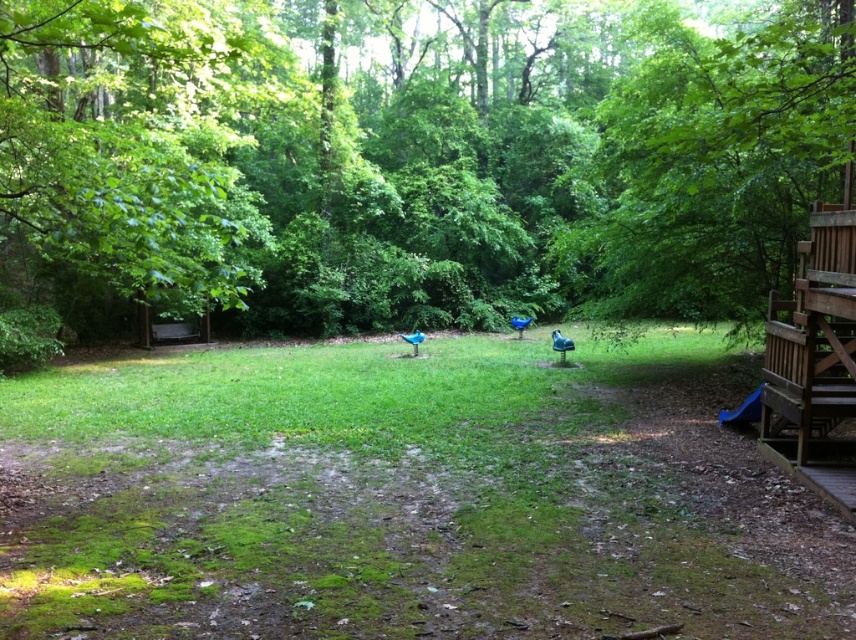
Between point (551, 339) and point (414, 337), which one is positioned in front?

Point (414, 337)

Is point (563, 349) closer to viewer compared to point (405, 339)?

Yes, point (563, 349) is in front of point (405, 339).

Who is more distant from viewer, [566,342] or [417,342]?

The point [417,342] is more distant.

Find the location of a particular element. This screenshot has height=640, width=856. green matte bird at center is located at coordinates (562, 344).

Does green grass at center have a lesser height compared to blue glossy statue at center?

No, green grass at center is not shorter than blue glossy statue at center.

Does point (248, 452) lie behind point (522, 326)?

No.

What do you see at coordinates (409, 497) in the screenshot? Image resolution: width=856 pixels, height=640 pixels. I see `green grass at center` at bounding box center [409, 497].

This screenshot has width=856, height=640. What are the coordinates of `green grass at center` in the screenshot? It's located at (409, 497).

Can you confirm if blue glossy bird at center is positioned below blue glossy statue at center?

Indeed, blue glossy bird at center is positioned under blue glossy statue at center.

Does blue glossy bird at center have a greater height compared to blue glossy statue at center?

Incorrect, blue glossy bird at center's height is not larger of blue glossy statue at center's.

Between point (412, 342) and point (510, 324), which one is positioned in front?

Positioned in front is point (412, 342).

Locate an element on the screen. blue glossy bird at center is located at coordinates (413, 339).